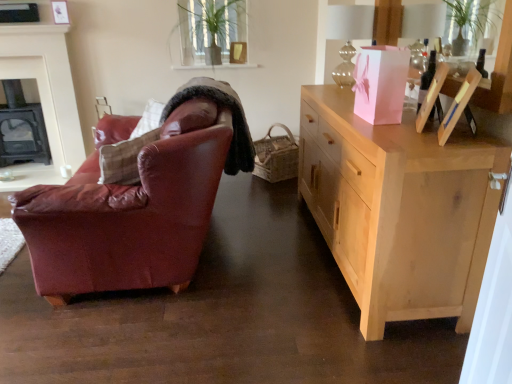
Locate an element on the screen. The image size is (512, 384). vacant area situated to the left side of natural wood cabinet at right is located at coordinates click(219, 297).